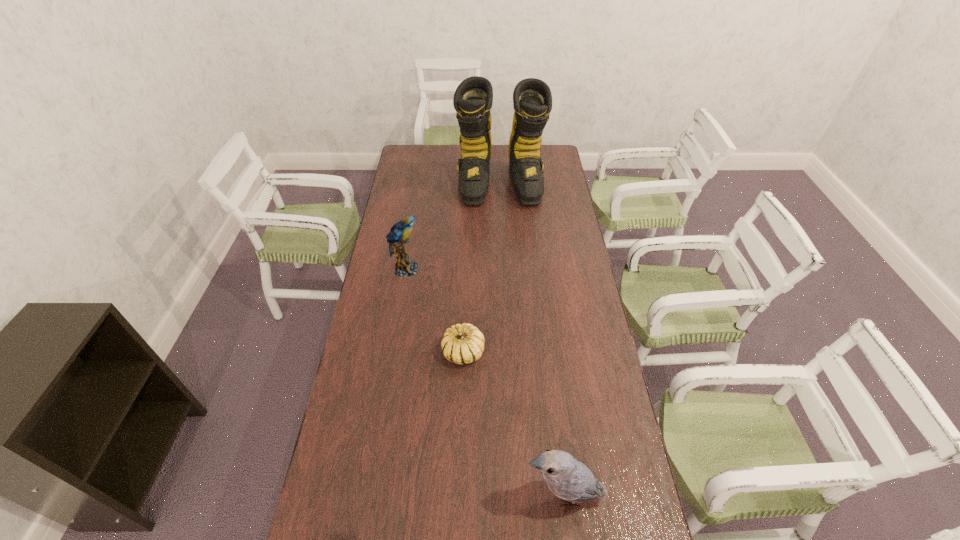
Where is `ski boots`? ski boots is located at coordinates (532, 100).

Where is `the farthest object`? This screenshot has width=960, height=540. the farthest object is located at coordinates (532, 100).

This screenshot has height=540, width=960. Identify the location of the farther parrot. (398, 236).

Where is `the third nearest object`? the third nearest object is located at coordinates (398, 236).

The height and width of the screenshot is (540, 960). In order to click on the nearest object in this screenshot , I will do `click(567, 478)`.

Locate an element on the screen. This screenshot has width=960, height=540. the right parrot is located at coordinates (567, 478).

Locate an element on the screen. the shortest object is located at coordinates pos(464,343).

Find the location of a particular element. Image resolution: width=960 pixels, height=540 pixels. the third farthest object is located at coordinates (464, 343).

You are a GUI agent. You are given a task and a screenshot of the screen. Output one action in this format:
    pyautogui.click(x=<x>, y=<y>)
    Task: Click on the blank space located 0.200m on the left of the farthest object
    This screenshot has height=540, width=960.
    Given the screenshot: What is the action you would take?
    pyautogui.click(x=418, y=184)

Locate an element on the screen. The image size is (960, 540). free space located on the face of the leftmost object is located at coordinates (478, 269).